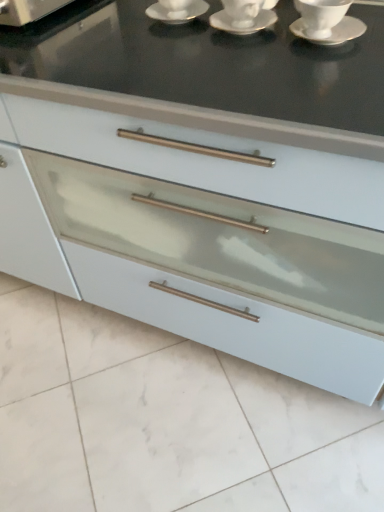
Find the location of `vacant region to the left of white glossy saucer at upper right, which ranks as the first saucer in right-to-left order`. vacant region to the left of white glossy saucer at upper right, which ranks as the first saucer in right-to-left order is located at coordinates (243, 48).